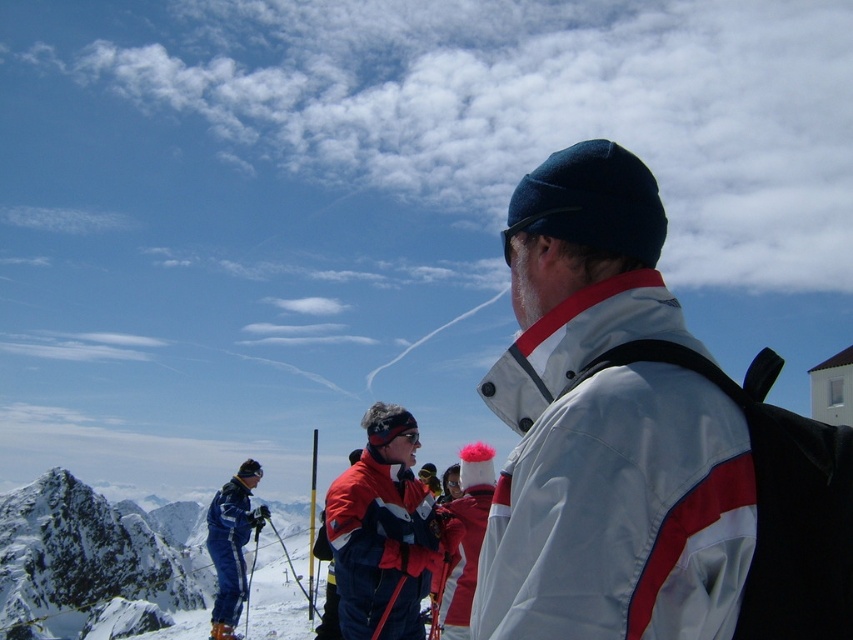
You are standing in the ski resort and see the snowy peak at left and the red fabric jacket at center. Which object is located to the left of the other?

The snowy peak at left is positioned on the left side of red fabric jacket at center.

You are a photographer trying to capture a photo of the snowy peak at left and the white matte jacket at center. From your current position, which object is closer to the camera?

The white matte jacket at center is positioned on the right side of snowy peak at left, so the snowy peak at left is closer to the camera.